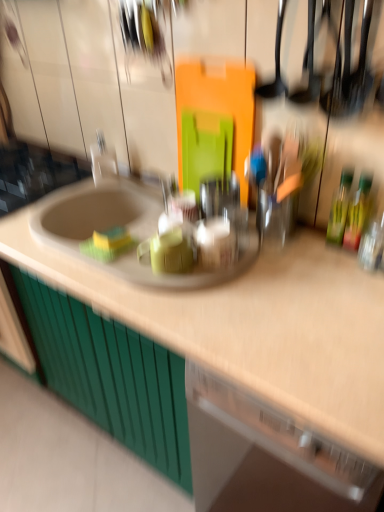
Identify the location of vacant area in front of green glass bottle at right, marked as the second bottle in a left-to-right arrangement. click(x=342, y=280).